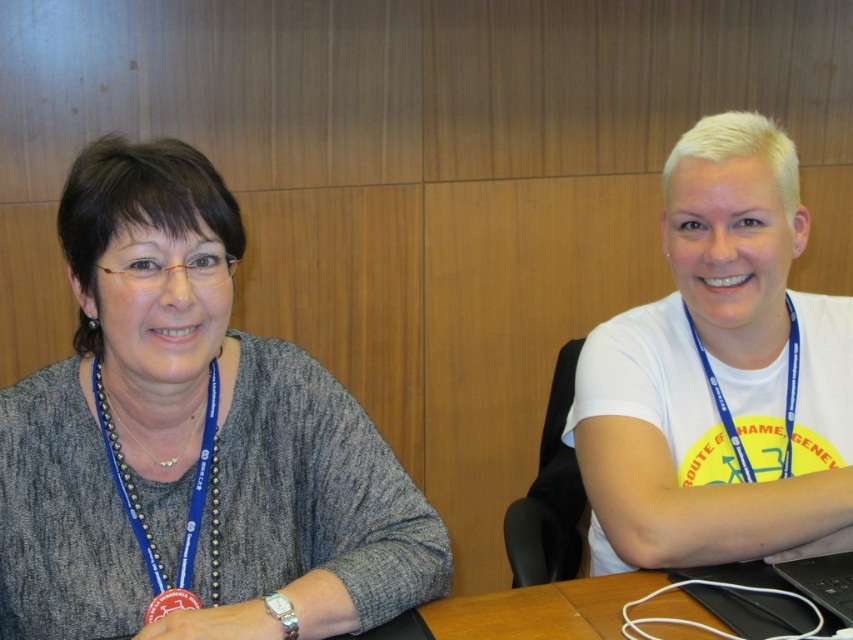
Between matte gray sweater at left and white matte t-shirt at center, which one appears on the right side from the viewer's perspective?

Positioned to the right is white matte t-shirt at center.

Can you confirm if matte gray sweater at left is positioned above white matte t-shirt at center?

Actually, matte gray sweater at left is below white matte t-shirt at center.

What do you see at coordinates (192, 440) in the screenshot? I see `matte gray sweater at left` at bounding box center [192, 440].

You are a GUI agent. You are given a task and a screenshot of the screen. Output one action in this format:
    pyautogui.click(x=<x>, y=<y>)
    Task: Click on the matte gray sweater at left
    The image size is (853, 640).
    Given the screenshot: What is the action you would take?
    pyautogui.click(x=192, y=440)

Does white matte t-shirt at center have a smaller size compared to blue fabric lanyard at upper right?

Actually, white matte t-shirt at center might be larger than blue fabric lanyard at upper right.

Which is behind, point (676, 234) or point (715, 397)?

Positioned behind is point (715, 397).

Where is `white matte t-shirt at center`? The image size is (853, 640). white matte t-shirt at center is located at coordinates (718, 374).

Is matte gray sweater at left thinner than blue fabric lanyard at left?

No.

Is the position of matte gray sweater at left less distant than that of blue fabric lanyard at left?

Yes.

Where is `matte gray sweater at left`? matte gray sweater at left is located at coordinates (192, 440).

Locate an element on the screen. Image resolution: width=853 pixels, height=640 pixels. matte gray sweater at left is located at coordinates (192, 440).